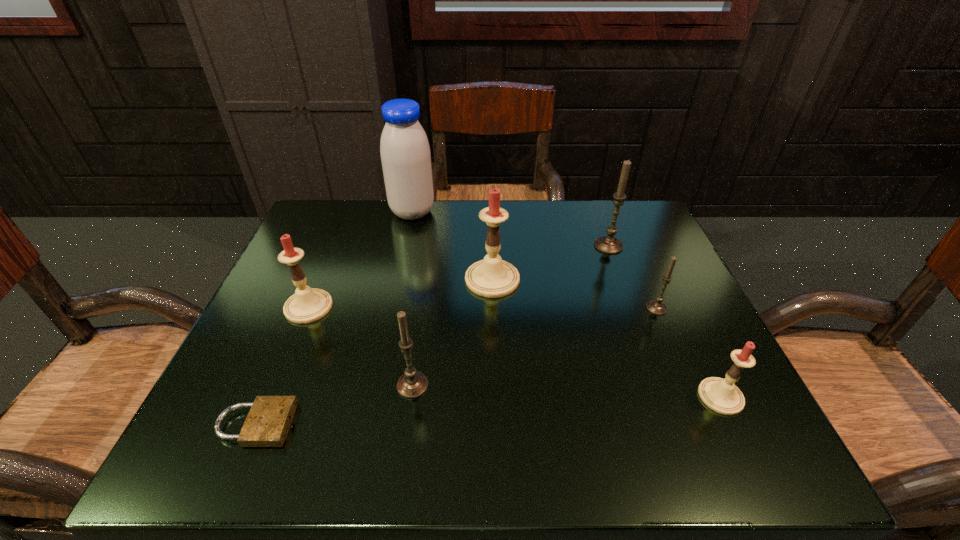
Where is `blue soya milk`? blue soya milk is located at coordinates (405, 153).

This screenshot has width=960, height=540. In order to click on the tallest object in this screenshot , I will do `click(405, 153)`.

Where is `the farthest gray candle`? the farthest gray candle is located at coordinates (608, 244).

This screenshot has height=540, width=960. Identify the location of the second farthest object. (608, 244).

The height and width of the screenshot is (540, 960). What are the coordinates of `the biggest red candle` in the screenshot? It's located at (492, 277).

Identify the location of the fourth object from right to left. This screenshot has width=960, height=540. (492, 277).

Image resolution: width=960 pixels, height=540 pixels. In order to click on the leftmost red candle in this screenshot , I will do `click(307, 305)`.

Find the location of `the leftmost candle`. the leftmost candle is located at coordinates (307, 305).

At what (x,y) coordinates should I click in order to perform the action: click on the leftmost gray candle. Please return your answer as a coordinate pair (x, y). The height and width of the screenshot is (540, 960). Looking at the image, I should click on (412, 384).

Where is `the nearest gray candle`? the nearest gray candle is located at coordinates (412, 384).